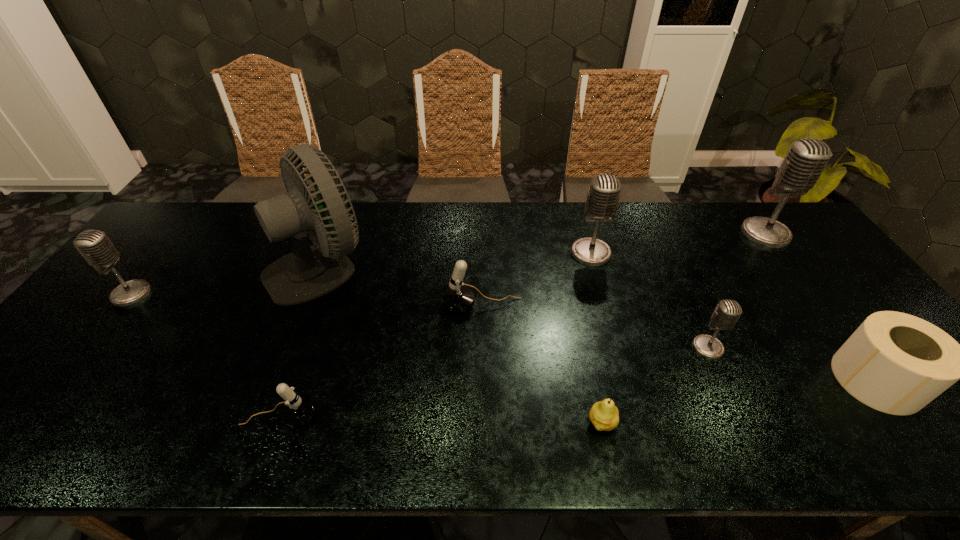
The height and width of the screenshot is (540, 960). I want to click on the fifth closest microphone to the second nearest microphone, so click(x=94, y=245).

What are the coordinates of `the closest gray microphone to the second microphone from right to left` in the screenshot? It's located at (602, 200).

Select which gray microphone appears as the third closest to the pear. Please provide its 2D coordinates. Your answer should be formatted as a tuple, i.e. [(x, y)], where the tuple contains the x and y coordinates of a point satisfying the conditions above.

[(806, 159)]

Identify the location of vacant region that satisfies the following two spatial constraints: 1. on the front side of the second microphone from right to left; 2. on the left side of the sixth object from right to left. This screenshot has height=540, width=960. (483, 348).

Where is `free spot that satisfies the following two spatial constraints: 1. on the back side of the nearer white microphone; 2. on the right side of the second microphone from right to left`? The height and width of the screenshot is (540, 960). free spot that satisfies the following two spatial constraints: 1. on the back side of the nearer white microphone; 2. on the right side of the second microphone from right to left is located at coordinates (303, 348).

The height and width of the screenshot is (540, 960). I want to click on vacant space that satisfies the following two spatial constraints: 1. in front of the fan to direct airflow; 2. on the right side of the shortest object, so click(x=261, y=423).

This screenshot has height=540, width=960. Identify the location of free space that satisfies the following two spatial constraints: 1. in front of the fan to direct airflow; 2. on the right side of the nearest microphone. (263, 416).